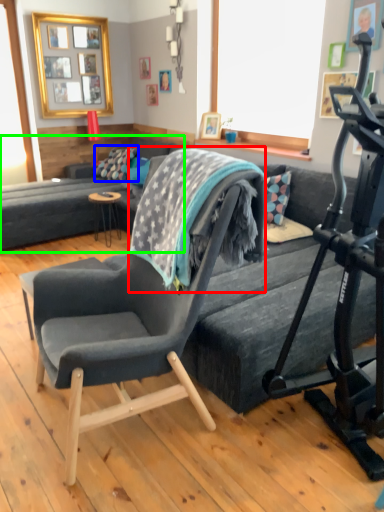
Question: Which is farther away from blanket (highlighted by a red box)? pillow (highlighted by a blue box) or studio couch (highlighted by a green box)?

Choices:
 (A) pillow
 (B) studio couch

Answer: (A)